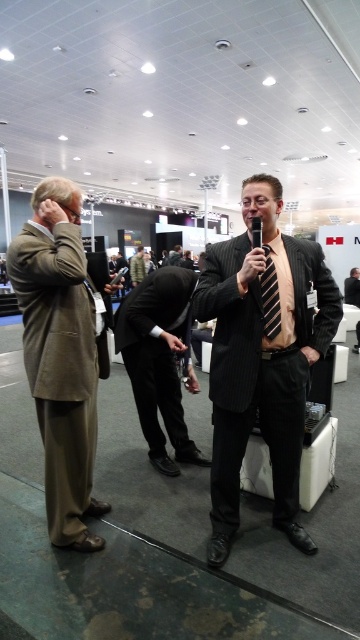
Question: Can you confirm if striped fabric suit at center is positioned to the right of black pinstripe suit at center?

Choices:
 (A) yes
 (B) no

Answer: (A)

Question: Does black striped tie at center have a larger size compared to khaki cotton suit at center?

Choices:
 (A) no
 (B) yes

Answer: (A)

Question: Is black pinstripe suit at center thinner than black striped tie at center?

Choices:
 (A) yes
 (B) no

Answer: (B)

Question: Considering the real-world distances, which object is farthest from the black pinstripe suit at center?

Choices:
 (A) khaki cotton suit at center
 (B) striped fabric suit at center

Answer: (A)

Question: Which is nearer to the khaki cotton suit at center?

Choices:
 (A) black pinstripe suit at center
 (B) matte brown suit at left
 (C) black striped tie at center

Answer: (A)

Question: Which object is positioned farthest from the black striped tie at center?

Choices:
 (A) striped fabric suit at center
 (B) khaki cotton suit at center

Answer: (B)